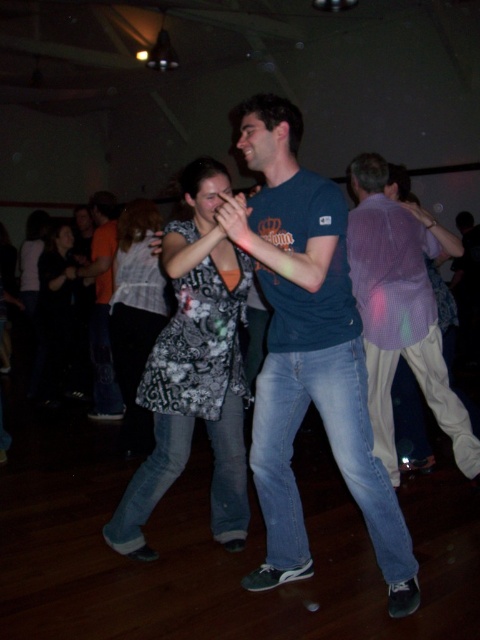
You are at a party and want to choose a dress that is smaller in size between the black fabric dress at left and the patterned fabric dress at lower left. Which one should you pick?

The black fabric dress at left has a smaller size compared to the patterned fabric dress at lower left, so you should pick the black fabric dress at left.